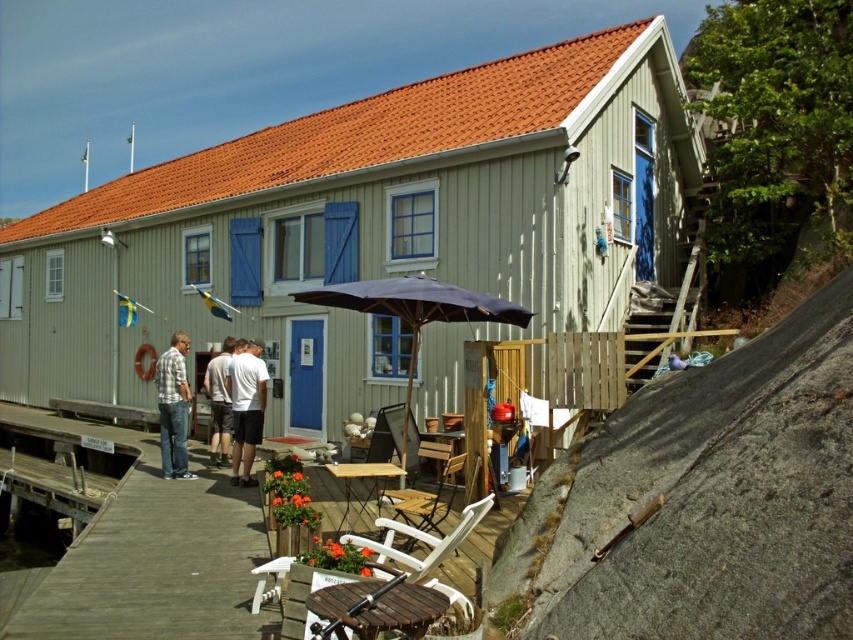
Does white wood deck at lower left have a larger size compared to gray cotton shirt at center?

Indeed, white wood deck at lower left has a larger size compared to gray cotton shirt at center.

Find the location of a particular element. This screenshot has width=853, height=640. white wood deck at lower left is located at coordinates (149, 556).

From the picture: Can you confirm if white cotton shirt at center is thinner than plaid shirt at center?

No, white cotton shirt at center is not thinner than plaid shirt at center.

Between white cotton shirt at center and plaid shirt at center, which one is positioned higher?

plaid shirt at center is higher up.

You are a GUI agent. You are given a task and a screenshot of the screen. Output one action in this format:
    pyautogui.click(x=<x>, y=<y>)
    Task: Click on the white cotton shirt at center
    The width and height of the screenshot is (853, 640).
    Given the screenshot: What is the action you would take?
    pyautogui.click(x=173, y=406)

Where is `plaid shirt at center`? plaid shirt at center is located at coordinates (173, 406).

Which is below, plaid shirt at center or gray cotton shirt at center?

gray cotton shirt at center is below.

Identify the location of plaid shirt at center. (173, 406).